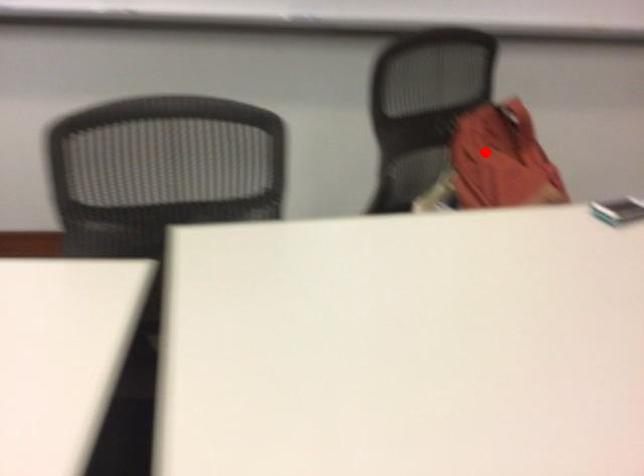
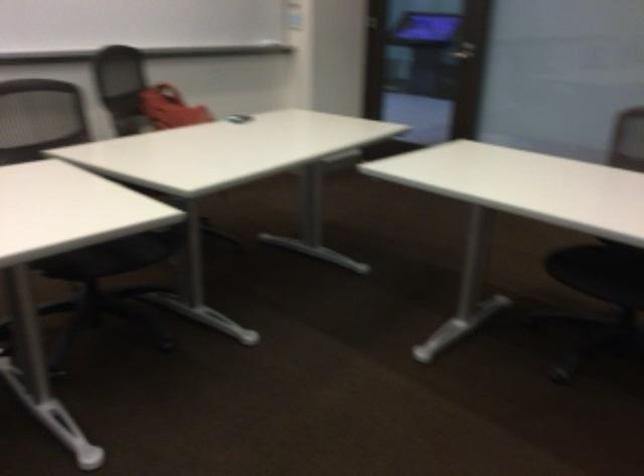
Question: I am providing you with two images of the same scene from different viewpoints. A red point is shown in image1. For the corresponding object point in image2, is it positioned nearer or farther from the camera?

Choices:
 (A) Nearer
 (B) Farther

Answer: (B)